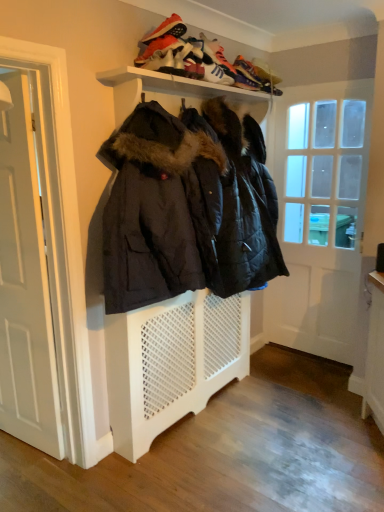
Question: Should I look upward or downward to see white glossy door at right, the 1th door viewed from the right?

Choices:
 (A) down
 (B) up

Answer: (B)

Question: Does white matte shelf at upper center lie in front of white suede sneaker at upper center, the 4th shoe when ordered from back to front?

Choices:
 (A) yes
 (B) no

Answer: (A)

Question: Is white matte shelf at upper center wider than white suede sneaker at upper center, the 4th shoe when ordered from back to front?

Choices:
 (A) no
 (B) yes

Answer: (B)

Question: Does white matte shelf at upper center come behind white suede sneaker at upper center, which ranks as the first shoe in front-to-back order?

Choices:
 (A) no
 (B) yes

Answer: (A)

Question: Would you say white suede sneaker at upper center, which ranks as the first shoe in front-to-back order, is part of white matte shelf at upper center's contents?

Choices:
 (A) no
 (B) yes

Answer: (A)

Question: Can you confirm if white matte shelf at upper center is thinner than white suede sneaker at upper center, which ranks as the first shoe in front-to-back order?

Choices:
 (A) yes
 (B) no

Answer: (B)

Question: Does white matte shelf at upper center have a lesser height compared to white suede sneaker at upper center, the 4th shoe when ordered from back to front?

Choices:
 (A) yes
 (B) no

Answer: (B)

Question: From the image's perspective, is shiny orange sneaker at upper center, which is the 4th shoe in front-to-back order, above white leather sneaker at upper center, which ranks as the second shoe in back-to-front order?

Choices:
 (A) no
 (B) yes

Answer: (B)

Question: Is shiny orange sneaker at upper center, which is counted as the 1th shoe, starting from the back, touching white leather sneaker at upper center, placed as the third shoe when sorted from front to back?

Choices:
 (A) no
 (B) yes

Answer: (A)

Question: Is the depth of shiny orange sneaker at upper center, which is the 4th shoe in front-to-back order, less than that of white leather sneaker at upper center, placed as the third shoe when sorted from front to back?

Choices:
 (A) no
 (B) yes

Answer: (A)

Question: From a real-world perspective, does shiny orange sneaker at upper center, which is the 4th shoe in front-to-back order, stand above white leather sneaker at upper center, which ranks as the second shoe in back-to-front order?

Choices:
 (A) no
 (B) yes

Answer: (B)

Question: Is shiny orange sneaker at upper center, which is counted as the 1th shoe, starting from the back, at the right side of white leather sneaker at upper center, which ranks as the second shoe in back-to-front order?

Choices:
 (A) yes
 (B) no

Answer: (A)

Question: Does shiny orange sneaker at upper center, which is counted as the 1th shoe, starting from the back, have a smaller size compared to white leather sneaker at upper center, which ranks as the second shoe in back-to-front order?

Choices:
 (A) no
 (B) yes

Answer: (A)

Question: From a real-world perspective, is white wooden door at left, the first door in the front-to-back sequence, located beneath white glossy door at right, placed as the second door when sorted from left to right?

Choices:
 (A) no
 (B) yes

Answer: (B)